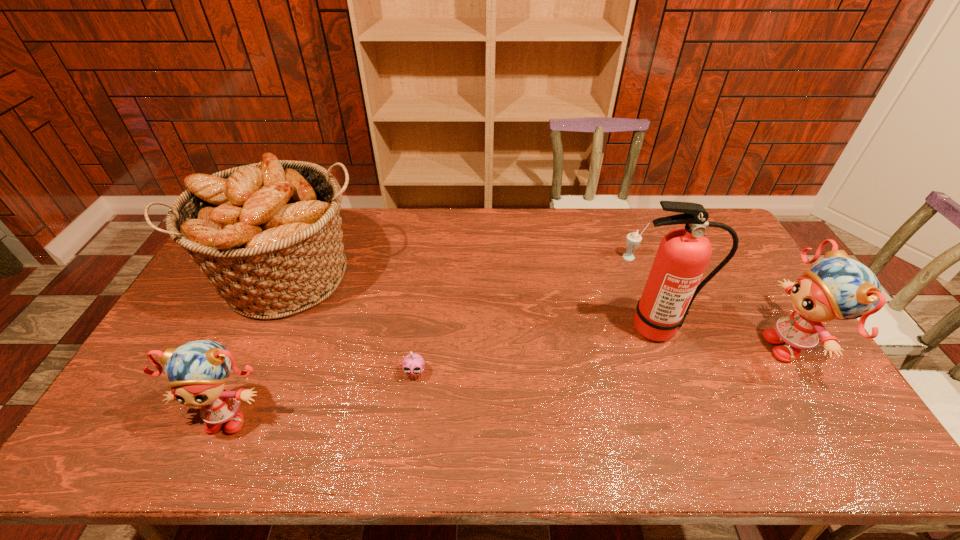
I want to click on blank area located 0.360m on the face of the taller doll, so click(636, 346).

In order to click on vacant area situated 0.110m on the face of the taller doll in this screenshot , I will do `click(724, 346)`.

Where is `vacant space positioned on the straw side of the milkshake`? The width and height of the screenshot is (960, 540). vacant space positioned on the straw side of the milkshake is located at coordinates (649, 304).

This screenshot has height=540, width=960. In order to click on free region located on the right of the second tallest object in this screenshot , I will do `click(481, 277)`.

Find the location of a particular element. vacant area situated on the face of the third object from left to right is located at coordinates (410, 414).

Where is `free space located on the handle side of the tallest object`? The height and width of the screenshot is (540, 960). free space located on the handle side of the tallest object is located at coordinates (673, 369).

Image resolution: width=960 pixels, height=540 pixels. Identify the location of object located at the far edge. (268, 235).

Image resolution: width=960 pixels, height=540 pixels. What are the coordinates of `doll that is at the left edge` in the screenshot? It's located at (x=197, y=371).

At what (x,y) coordinates should I click in order to perform the action: click on basket situated at the left edge. Please return your answer as a coordinate pair (x, y). Looking at the image, I should click on (268, 235).

At what (x,y) coordinates should I click in order to perform the action: click on object positioned at the right edge. Please return your answer as a coordinate pair (x, y). Looking at the image, I should click on (837, 287).